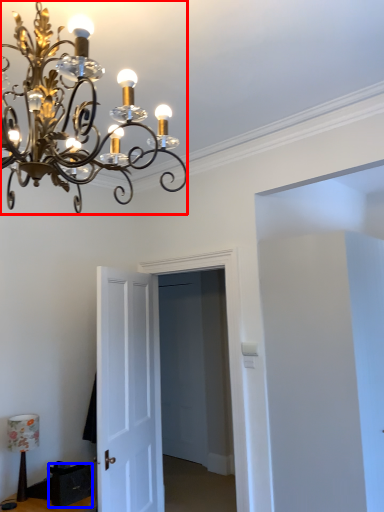
Question: Which object is closer to the camera taking this photo, lamp (highlighted by a red box) or drawer (highlighted by a blue box)?

Choices:
 (A) lamp
 (B) drawer

Answer: (A)